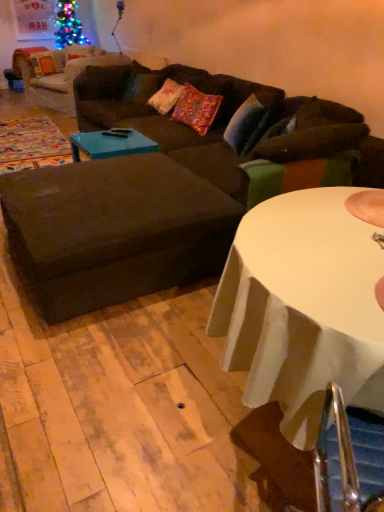
Identify the location of free space to the left of white glossy table at center. tap(106, 390).